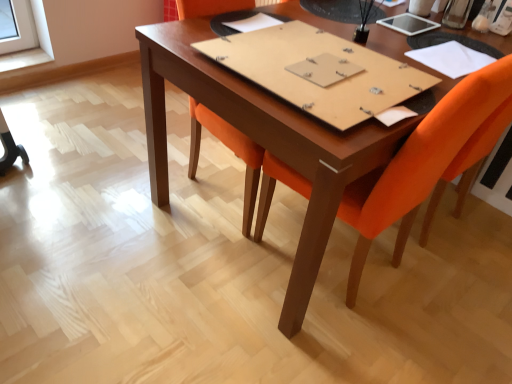
Find the location of a particular element. vacant space to the right of white paper at center, which is the 1th notebook from left to right is located at coordinates (300, 32).